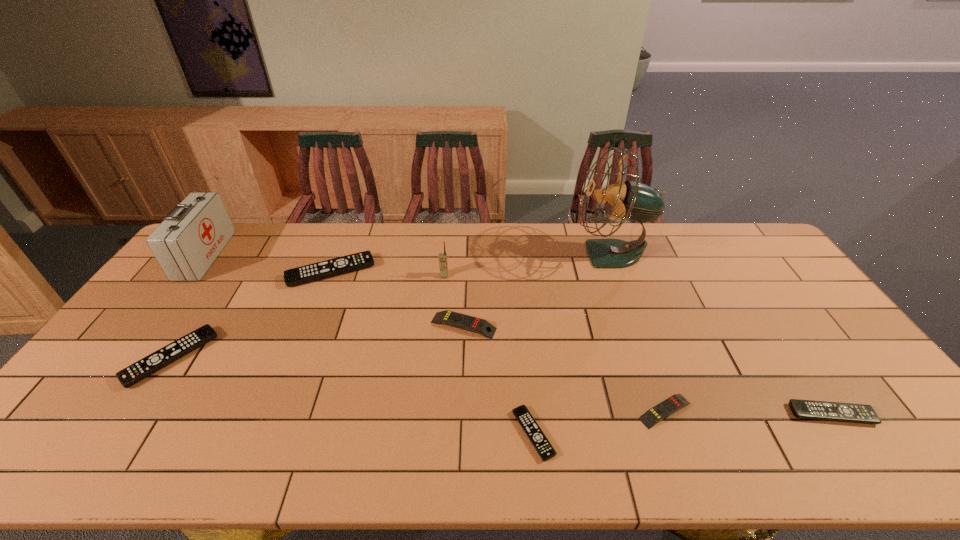
The height and width of the screenshot is (540, 960). I want to click on free spot between the second farthest black remote control and the eighth shortest object, so click(x=188, y=307).

I want to click on free spot between the second tallest object and the third biggest black remote control, so click(x=518, y=335).

The height and width of the screenshot is (540, 960). I want to click on free spot between the smallest black remote control and the red first-aid kit, so click(370, 345).

Locate an element on the screen. empty location between the cellular telephone and the left yellow remote control is located at coordinates (454, 301).

Locate an element on the screen. The image size is (960, 540). vacant area that lies between the fan and the second remote control from right to left is located at coordinates (638, 333).

This screenshot has height=540, width=960. In order to click on vacant point located between the first-aid kit and the left yellow remote control in this screenshot , I will do 334,291.

Where is `vacant space that's between the right yellow remote control and the blue fan`? Image resolution: width=960 pixels, height=540 pixels. vacant space that's between the right yellow remote control and the blue fan is located at coordinates (638, 333).

Identify the location of vacant region between the farther yellow remote control and the second remote control from right to left. (564, 368).

I want to click on vacant space that is in between the third tallest object and the rightmost remote control, so click(x=637, y=345).

Where is `the second closest object relative to the third black remote control from right to left`? The width and height of the screenshot is (960, 540). the second closest object relative to the third black remote control from right to left is located at coordinates (443, 264).